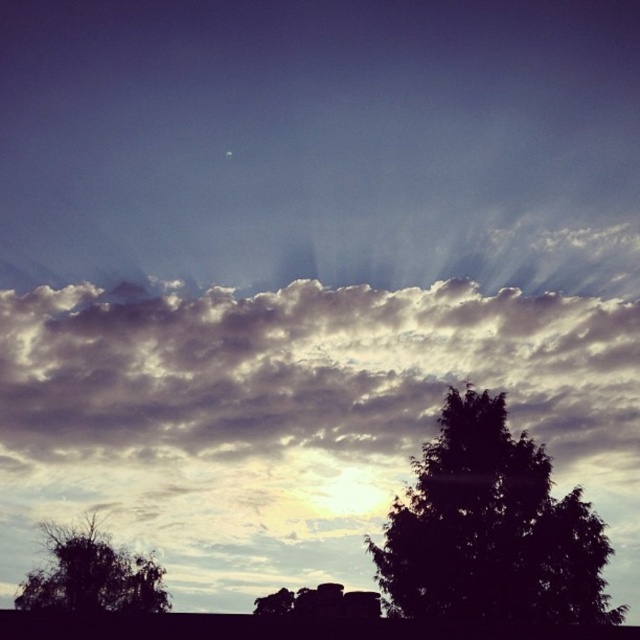
You are a bird flying over a field and see the dark green leafy tree at lower right and the silhouette leafy tree at lower left. Which tree would you choose to land on if you want to land on the larger one?

The silhouette leafy tree at lower left is larger than the dark green leafy tree at lower right, so you should land on the silhouette leafy tree at lower left.

You are standing at the center of the image and want to walk towards the dark green leafy tree at lower right. Which direction should you head?

The dark green leafy tree at lower right is located at point 0.828 on the x axis and 0.767 on the y axis. Since you are at the center, you should move towards the lower right direction to reach it.